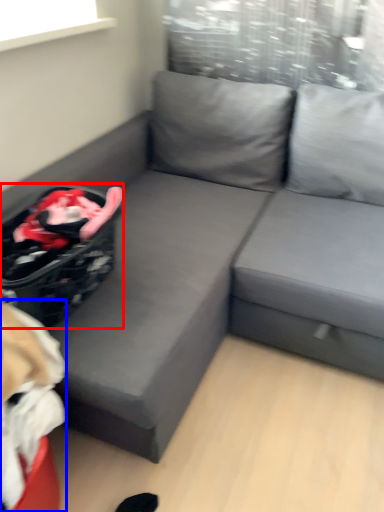
Question: Which point is further to the camera, laundry basket (highlighted by a red box) or bean bag chair (highlighted by a blue box)?

Choices:
 (A) laundry basket
 (B) bean bag chair

Answer: (A)